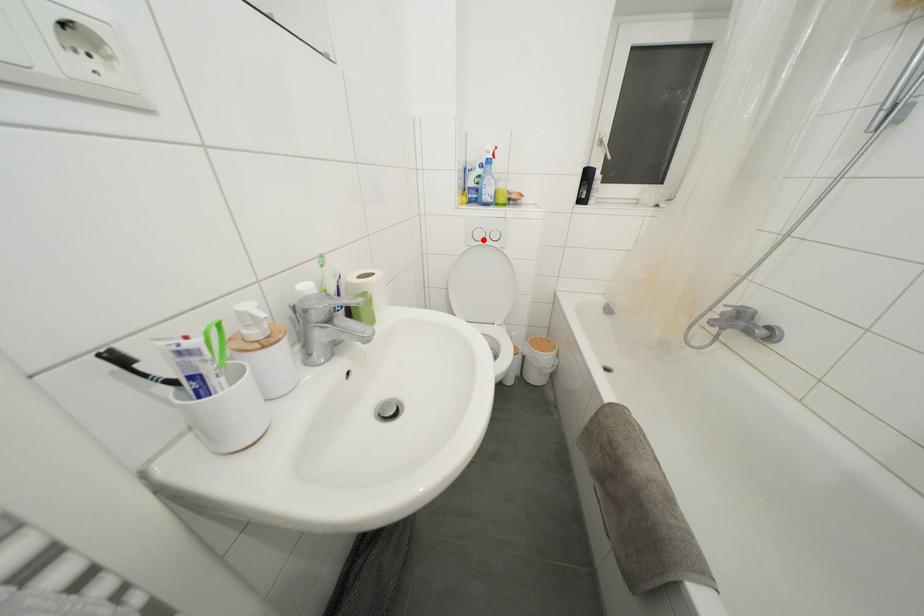
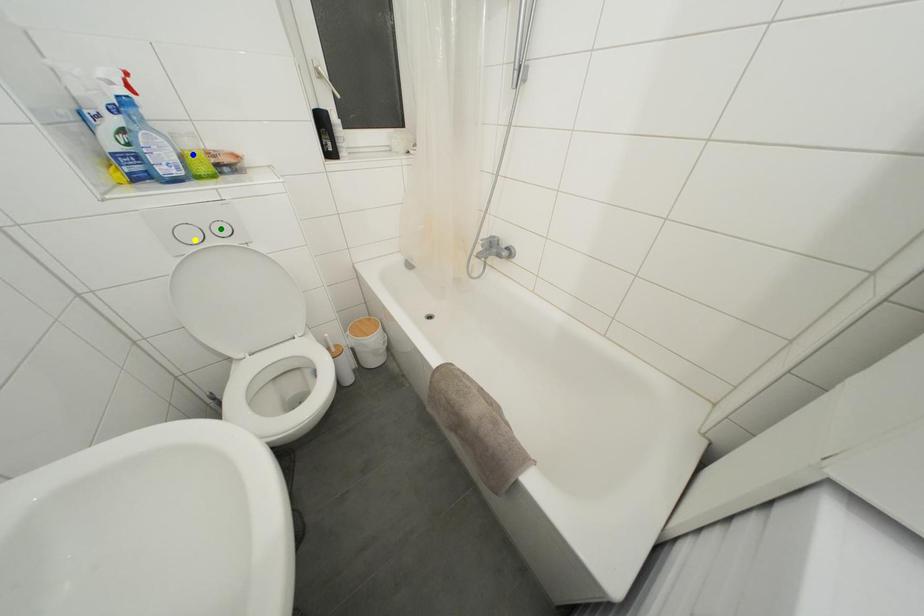
Question: I am providing you with two images of the same scene from different viewpoints. A red point is marked on the first image. You are given multiple points on the second image. Which point in image 2 is actually the same real-world point as the red point in image 1?

Choices:
 (A) blue point
 (B) green point
 (C) yellow point

Answer: (C)